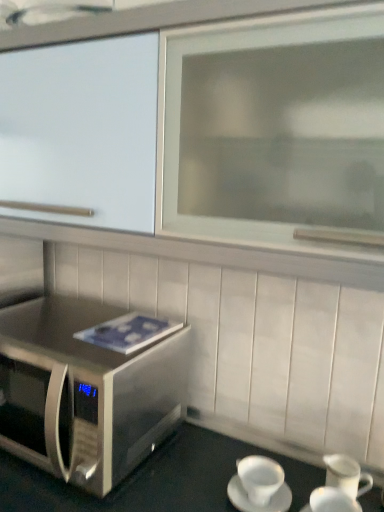
Question: Is stainless steel microwave at lower left not near stainless steel microwave oven at lower left?

Choices:
 (A) no
 (B) yes

Answer: (A)

Question: From the image's perspective, would you say stainless steel microwave at lower left is positioned over stainless steel microwave oven at lower left?

Choices:
 (A) yes
 (B) no

Answer: (B)

Question: Is stainless steel microwave at lower left thinner than stainless steel microwave oven at lower left?

Choices:
 (A) no
 (B) yes

Answer: (A)

Question: Is stainless steel microwave at lower left touching stainless steel microwave oven at lower left?

Choices:
 (A) yes
 (B) no

Answer: (B)

Question: From a real-world perspective, does stainless steel microwave at lower left stand above stainless steel microwave oven at lower left?

Choices:
 (A) yes
 (B) no

Answer: (B)

Question: Is white ceramic coffee cup at lower right, which appears as the 1th coffee cup when viewed from the right, in front of or behind stainless steel microwave oven at lower left in the image?

Choices:
 (A) front
 (B) behind

Answer: (A)

Question: From the image's perspective, is white ceramic coffee cup at lower right, which is counted as the 2th coffee cup, starting from the left, positioned above or below stainless steel microwave oven at lower left?

Choices:
 (A) above
 (B) below

Answer: (B)

Question: Does point (340, 500) appear closer or farther from the camera than point (162, 415)?

Choices:
 (A) closer
 (B) farther

Answer: (A)

Question: Is white ceramic coffee cup at lower right, which is counted as the 2th coffee cup, starting from the left, taller or shorter than stainless steel microwave oven at lower left?

Choices:
 (A) short
 (B) tall

Answer: (A)

Question: In terms of size, does white ceramic coffee cup at lower right, which appears as the 1th coffee cup when viewed from the right, appear bigger or smaller than stainless steel microwave at lower left?

Choices:
 (A) big
 (B) small

Answer: (B)

Question: Is white ceramic coffee cup at lower right, which is counted as the 2th coffee cup, starting from the left, spatially inside stainless steel microwave at lower left, or outside of it?

Choices:
 (A) inside
 (B) outside

Answer: (A)

Question: Is point (349, 498) closer or farther from the camera than point (173, 504)?

Choices:
 (A) farther
 (B) closer

Answer: (A)

Question: Considering the relative positions of white ceramic coffee cup at lower right, which appears as the 1th coffee cup when viewed from the right, and stainless steel microwave at lower left in the image provided, is white ceramic coffee cup at lower right, which appears as the 1th coffee cup when viewed from the right, to the left or to the right of stainless steel microwave at lower left?

Choices:
 (A) left
 (B) right

Answer: (B)

Question: In the image, is white ceramic cup at lower right, marked as the second coffee cup in a right-to-left arrangement, on the left side or the right side of white ceramic coffee cup at lower right, which is counted as the 2th coffee cup, starting from the left?

Choices:
 (A) right
 (B) left

Answer: (B)

Question: Based on their sizes in the image, would you say white ceramic cup at lower right, marked as the second coffee cup in a right-to-left arrangement, is bigger or smaller than white ceramic coffee cup at lower right, which is counted as the 2th coffee cup, starting from the left?

Choices:
 (A) small
 (B) big

Answer: (A)